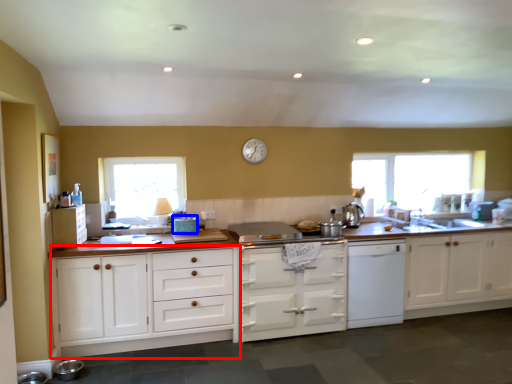
Question: Among these objects, which one is nearest to the camera, cabinetry (highlighted by a red box) or appliance (highlighted by a blue box)?

Choices:
 (A) cabinetry
 (B) appliance

Answer: (A)